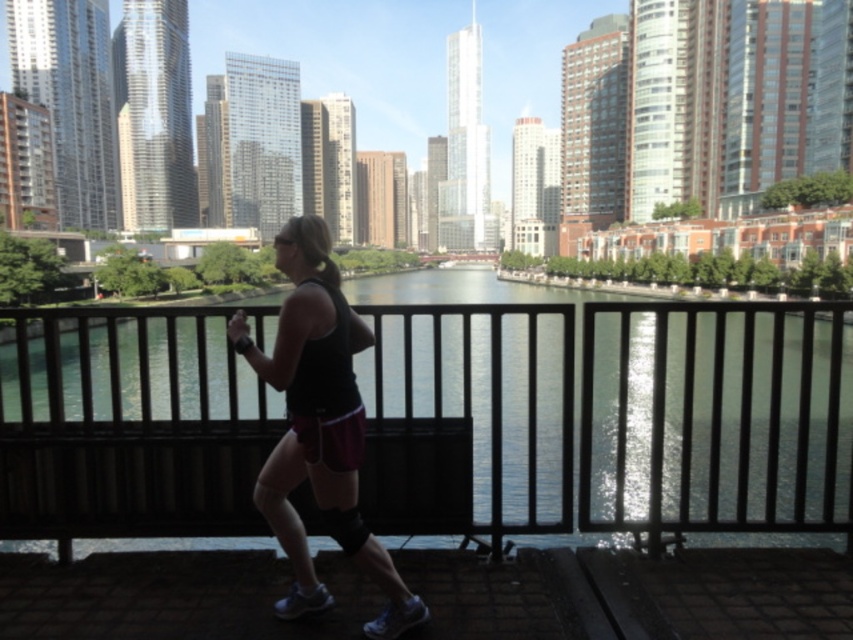
You are a photographer aiming to capture the jogger in the scene. To ensure the black matte tank top at center is visible against the green glass water at center, which object should be positioned closer to the camera?

The black matte tank top at center should be positioned closer to the camera than the green glass water at center because the green glass water at center is located above the black matte tank top at center, so adjusting their positions can help avoid the tank top being obscured by the reflective water.

You are a photographer trying to capture the jogger in the scene. You notice the green glass water at center and the black matte tank top at center. Which object is wider in the image?

The green glass water at center is wider than the black matte tank top at center according to the description.

You are a drone operator trying to capture the jogger in the scene. The coordinates given are for a point in the image. What is located at the coordinates point (602, 410)?

The point (602, 410) marks green glass water at center.